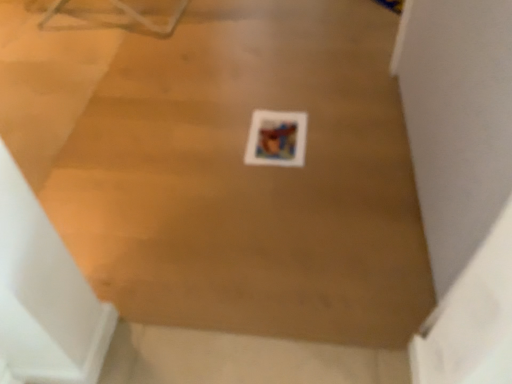
This screenshot has width=512, height=384. Find the location of `free space underneath matte paper print at center (from a real-world perspective)`. free space underneath matte paper print at center (from a real-world perspective) is located at coordinates (276, 136).